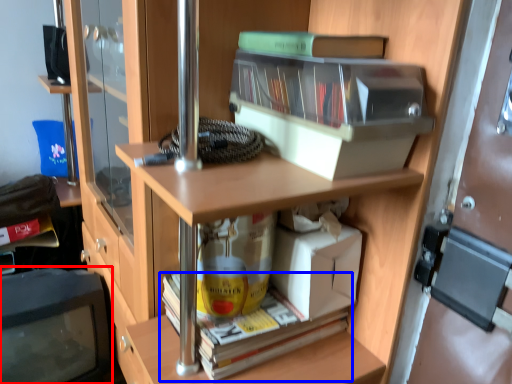
Question: Which object appears closest to the camera in this image, computer monitor (highlighted by a red box) or book (highlighted by a blue box)?

Choices:
 (A) computer monitor
 (B) book

Answer: (B)